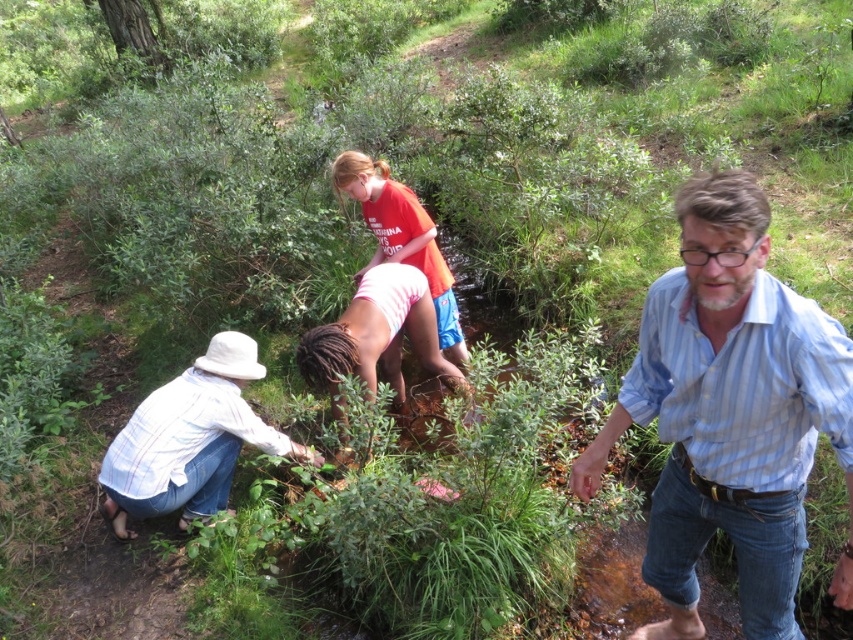
You are organizing a group photo and need to arrange two participants based on their clothing sizes. The blue striped shirt at center and the matte red shirt at center are the two subjects. Which shirt should be placed in the front row to ensure visibility?

The blue striped shirt at center should be placed in the front row because it has a larger size compared to the matte red shirt at center, ensuring better visibility.

You are organizing a group photo and need to arrange the blue striped shirt at center and the matte red shirt at center side by side. Which shirt should be placed on the left to ensure they fit within a 1.2 meter wide frame?

The blue striped shirt at center has a smaller width than the matte red shirt at center. To fit both within the 1.2 meter frame, place the wider matte red shirt at center on the left and the narrower blue striped shirt at center on the right. This arrangement optimizes space usage while accommodating their sizes.

From the picture: You are part of a hiking group and see the blue striped shirt at center and the pink fabric at center in the scene. Which object is positioned more to the right?

The blue striped shirt at center is positioned more to the right than the pink fabric at center.